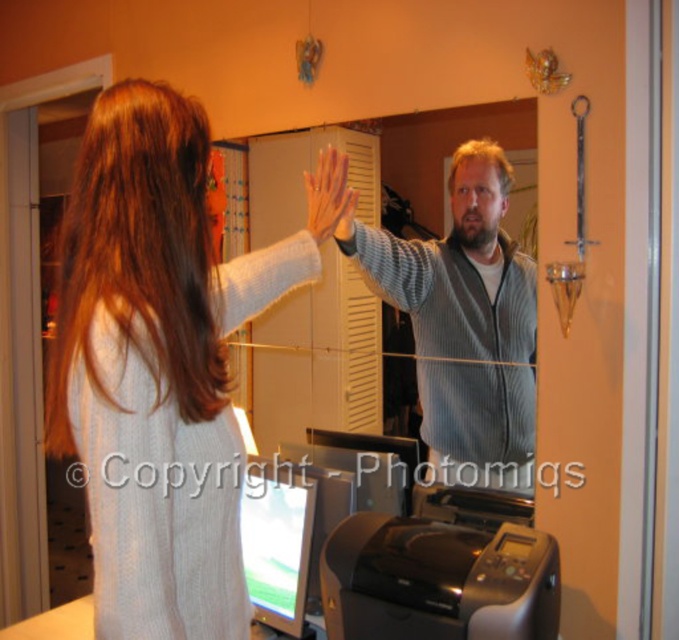
Who is more forward, (268, 474) or (323, 221)?

Point (323, 221) is more forward.

Does matte silver computer at lower center have a larger size compared to matte gray sweater at upper center?

Actually, matte silver computer at lower center might be smaller than matte gray sweater at upper center.

Locate an element on the screen. The width and height of the screenshot is (679, 640). matte silver computer at lower center is located at coordinates (276, 541).

What are the coordinates of `matte silver computer at lower center` in the screenshot? It's located at (276, 541).

Is white knitted sweater at upper left closer to camera compared to matte silver computer at lower center?

Yes, it is.

Can you confirm if white knitted sweater at upper left is shorter than matte silver computer at lower center?

No.

Between point (130, 144) and point (255, 563), which one is positioned in front?

Point (130, 144) is more forward.

Find the location of a particular element. This screenshot has width=679, height=640. white knitted sweater at upper left is located at coordinates (155, 365).

How distant is white knitted sweater at upper left from matte gray sweater at upper center?

white knitted sweater at upper left is 14.47 inches away from matte gray sweater at upper center.

Can you confirm if white knitted sweater at upper left is bigger than matte gray sweater at upper center?

Correct, white knitted sweater at upper left is larger in size than matte gray sweater at upper center.

Who is more distant from viewer, (198, 476) or (312, 172)?

The point (312, 172) is behind.

This screenshot has height=640, width=679. Identify the location of white knitted sweater at upper left. (155, 365).